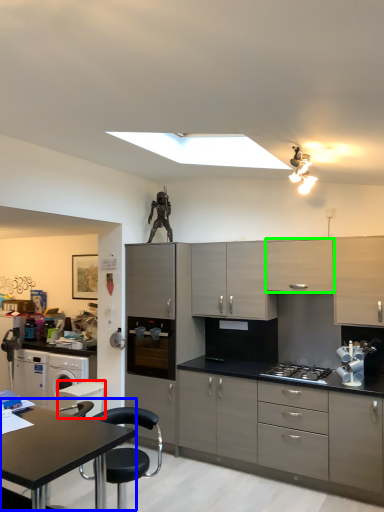
Question: Considering the real-world distances, which object is farthest from appliance (highlighted by a red box)? table (highlighted by a blue box) or cabinetry (highlighted by a green box)?

Choices:
 (A) table
 (B) cabinetry

Answer: (B)